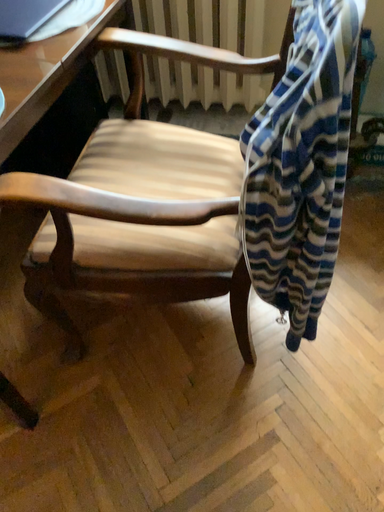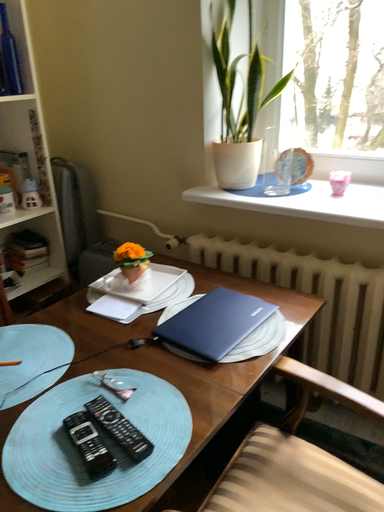
Question: How did the camera likely rotate when shooting the video?

Choices:
 (A) rotated upward
 (B) rotated downward

Answer: (A)